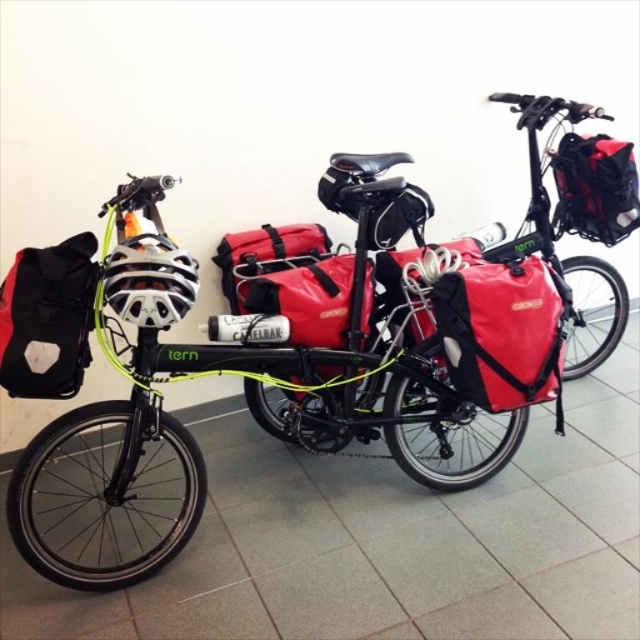
You are a delivery person who needs to attach a package to your bike. You have a choice between the matte black bicycle at left and the red fabric bag at center. Which bike do you choose to attach the package to, and why?

You should choose the matte black bicycle at left because it is in front of the red fabric bag at center, making it easier to access and attach the package without obstruction.

You are standing in front of the bicycles and want to locate the black fabric backpack at left. According to the coordinates provided, where would you look relative to the image?

The black fabric backpack at left is located at point 0.498 on the x axis and 0.075 on the y axis of the image.

You are a delivery person who needs to attach a package to your bike. You have a black fabric backpack at left and a camera. Which item is closer to the camera?

The black fabric backpack at left is 4.41 feet away from the camera, so the camera is closer to the camera than the backpack.